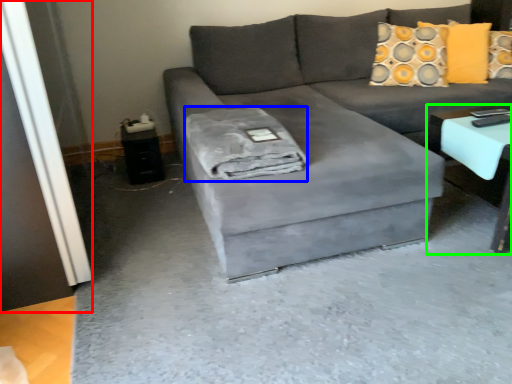
Question: Which object is positioned closest to glass door (highlighted by a red box)? Select from material (highlighted by a blue box) and table (highlighted by a green box).

Choices:
 (A) material
 (B) table

Answer: (A)